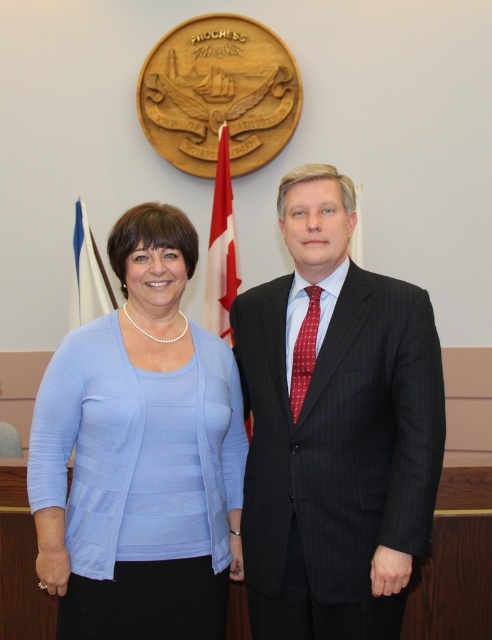
You are a photographer setting up for a group photo. You need to ensure that the dark pinstripe suit at center and the blue fabric flag at left are both visible in the frame. Based on their sizes, which object should you focus on first to ensure proper framing?

The dark pinstripe suit at center is taller than the blue fabric flag at left, so you should focus on the dark pinstripe suit at center first to ensure proper framing.

Looking at this image, you are a photographer setting up for a group photo. You notice the light blue fabric shirt at center and the blue fabric flag at left. Which object is positioned to the right of the other?

The light blue fabric shirt at center is to the right of the blue fabric flag at left according to the description.